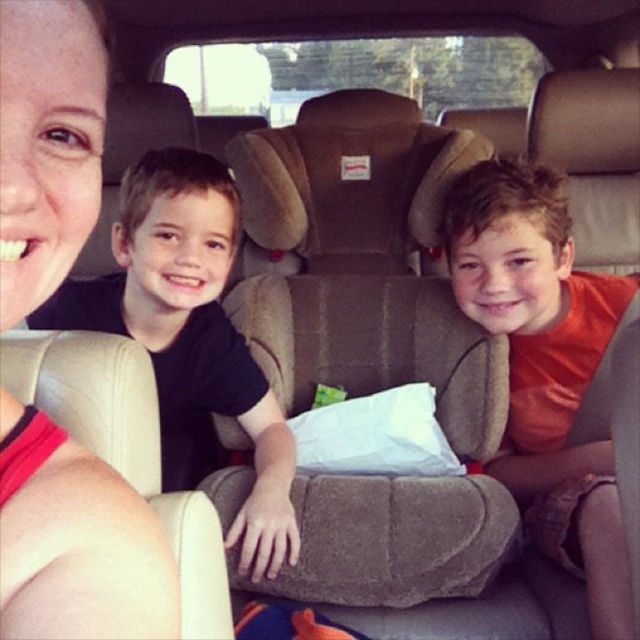
Is matte pink tank top at upper left positioned behind orange cotton shirt at center?

That is False.

From the picture: Is matte pink tank top at upper left smaller than orange cotton shirt at center?

Yes.

This screenshot has height=640, width=640. Identify the location of matte pink tank top at upper left. point(76,540).

Locate an element on the screen. The image size is (640, 640). orange cotton shirt at center is located at coordinates (545, 365).

Which is behind, point (611, 548) or point (70, 280)?

The point (70, 280) is more distant.

Between point (522, 330) and point (273, 456), which one is positioned in front?

Point (273, 456) is in front.

I want to click on orange cotton shirt at center, so click(x=545, y=365).

Is point (12, 416) more distant than point (138, 269)?

No.

Does matte pink tank top at upper left have a lesser width compared to black matte shirt at center?

Indeed, matte pink tank top at upper left has a lesser width compared to black matte shirt at center.

Is point (0, 493) more distant than point (134, 244)?

No, (0, 493) is closer to viewer.

You are a GUI agent. You are given a task and a screenshot of the screen. Output one action in this format:
    pyautogui.click(x=<x>, y=<y>)
    Task: Click on the matte pink tank top at upper left
    The height and width of the screenshot is (640, 640).
    Given the screenshot: What is the action you would take?
    pyautogui.click(x=76, y=540)